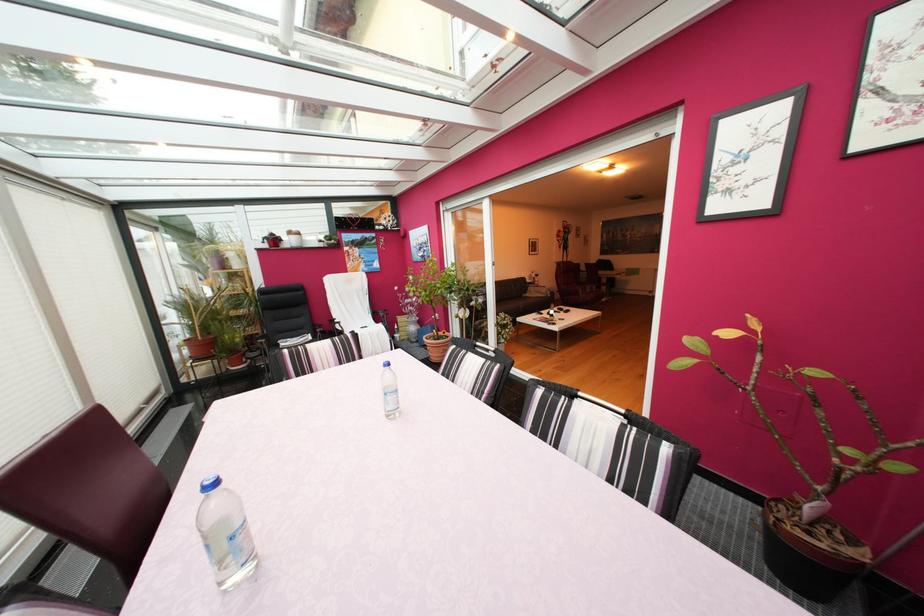
Image resolution: width=924 pixels, height=616 pixels. Describe the element at coordinates (315, 331) in the screenshot. I see `a black chair armrest` at that location.